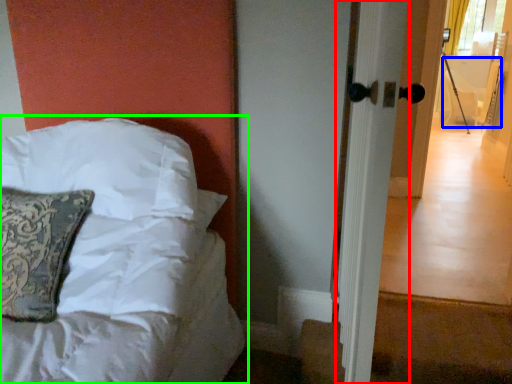
Question: Based on their relative distances, which object is farther from screen door (highlighted by a red box)? Choose from armchair (highlighted by a blue box) and bed (highlighted by a green box).

Choices:
 (A) armchair
 (B) bed

Answer: (A)